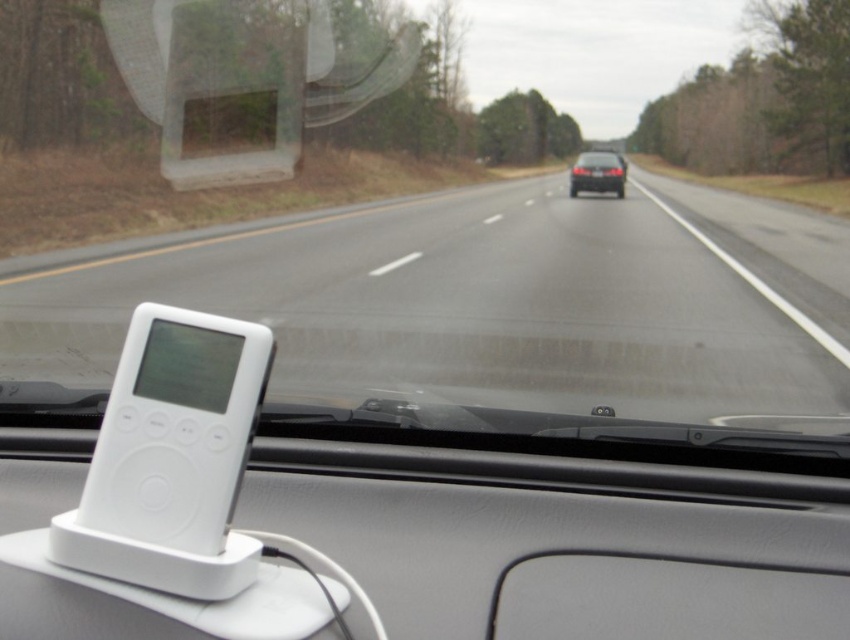
Question: Does white plastic device at center have a larger size compared to black glossy sedan at center?

Choices:
 (A) yes
 (B) no

Answer: (B)

Question: Is white plastic device at center positioned before white matte ipod at center?

Choices:
 (A) yes
 (B) no

Answer: (B)

Question: Which is nearer to the white matte ipod at center?

Choices:
 (A) black glossy sedan at center
 (B) white plastic device at center

Answer: (B)

Question: Which point appears farthest from the camera in this image?

Choices:
 (A) (599, 180)
 (B) (219, 445)

Answer: (A)

Question: Can you confirm if white plastic device at center is positioned above white matte ipod at center?

Choices:
 (A) yes
 (B) no

Answer: (A)

Question: Which point is farther to the camera?

Choices:
 (A) white plastic device at center
 (B) black glossy sedan at center

Answer: (B)